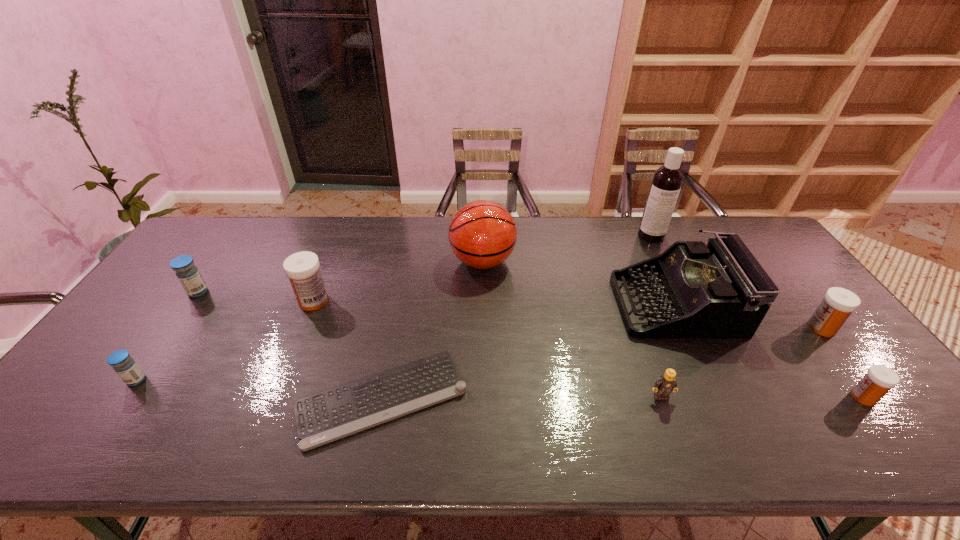
Where is `free space between the tallest medicine and the black typewriter`? This screenshot has width=960, height=540. free space between the tallest medicine and the black typewriter is located at coordinates (494, 302).

You are a GUI agent. You are given a task and a screenshot of the screen. Output one action in this format:
    pyautogui.click(x=<x>, y=<y>)
    Task: Click on the vacant area between the tallest object and the computer keyboard
    Image resolution: width=960 pixels, height=540 pixels.
    Given the screenshot: What is the action you would take?
    pyautogui.click(x=516, y=317)

Find the location of `unoccupied area between the gray computer keyboard and the tan Lego`. unoccupied area between the gray computer keyboard and the tan Lego is located at coordinates (521, 397).

This screenshot has height=540, width=960. Identify the location of free space that is in between the smaller blue medicine and the smallest white medicine. (500, 389).

Where is `the third closest object to the second nearest white medicine`? The width and height of the screenshot is (960, 540). the third closest object to the second nearest white medicine is located at coordinates point(667,180).

Identify the location of object that is the seventh closest to the black typewriter. The width and height of the screenshot is (960, 540). (302, 268).

The image size is (960, 540). Identify the location of medicine that stands as the second closest to the bigger blue medicine. (302, 268).

You are a GUI agent. You are given a task and a screenshot of the screen. Output one action in this format:
    pyautogui.click(x=<x>, y=<y>)
    Task: Click on the fifth closest medicine to the computer keyboard
    Image resolution: width=960 pixels, height=540 pixels.
    Given the screenshot: What is the action you would take?
    pyautogui.click(x=838, y=303)

Point out which white medicine is positioned as the third nearest to the nearer blue medicine. Please provide its 2D coordinates. Your answer should be formatted as a tuple, i.e. [(x, y)], where the tuple contains the x and y coordinates of a point satisfying the conditions above.

[(838, 303)]

Select which white medicine is the second closest to the second farthest white medicine. Please provide its 2D coordinates. Your answer should be formatted as a tuple, i.e. [(x, y)], where the tuple contains the x and y coordinates of a point satisfying the conditions above.

[(302, 268)]